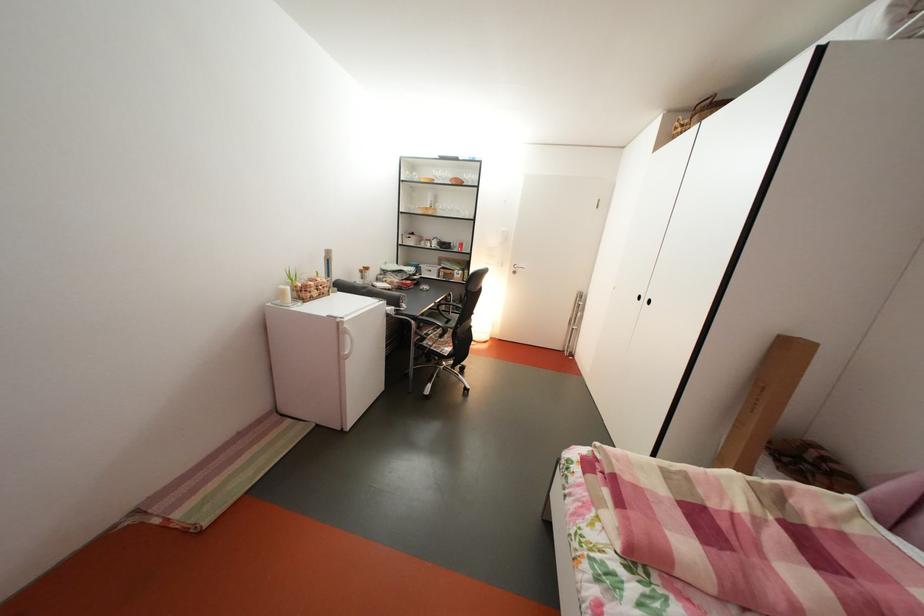
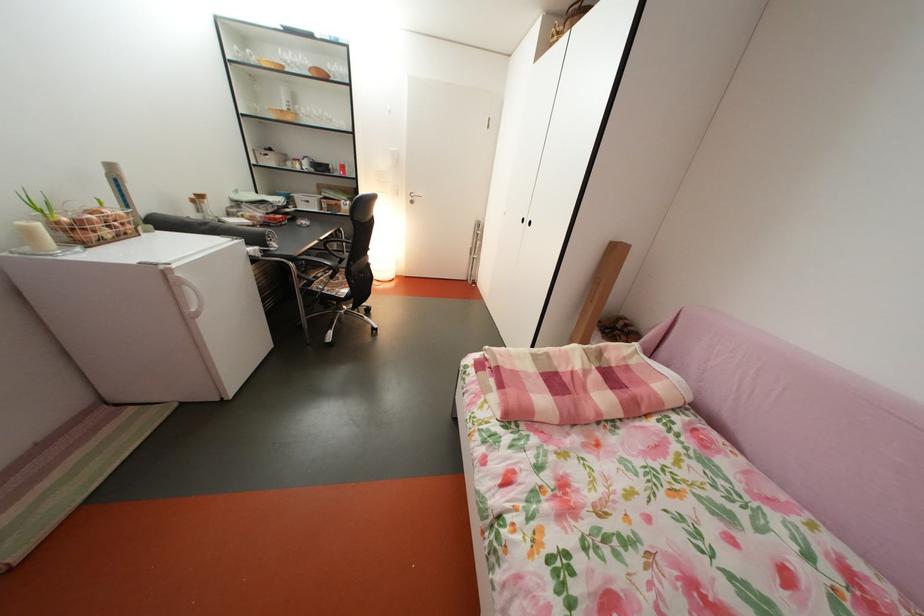
The point at (783, 524) is marked in the first image. Where is the corresponding point in the second image?

(604, 374)